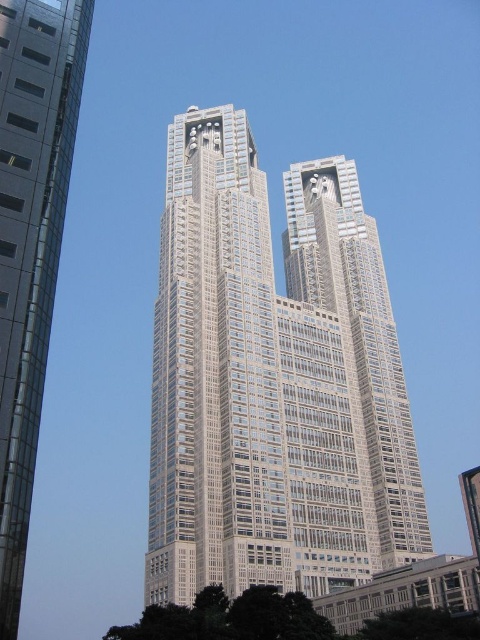
You are an architect reviewing a city model and notice the white glass building at center and the silver glass skyscraper at center. Based on their positions in the model, which one is situated lower in elevation?

The white glass building at center is situated lower in elevation because it is positioned below the silver glass skyscraper at center.

You are standing in front of the two identical skyscrapers. You notice a white glass building at center. Based on its 2D coordinates, can you determine if it is positioned to the left or right of the center point of the image?

The 2D location of the white glass building at center is at point [273,380]. Since the coordinates are slightly above and to the right of the exact center point, the white glass building at center is positioned to the right of the center point of the image.